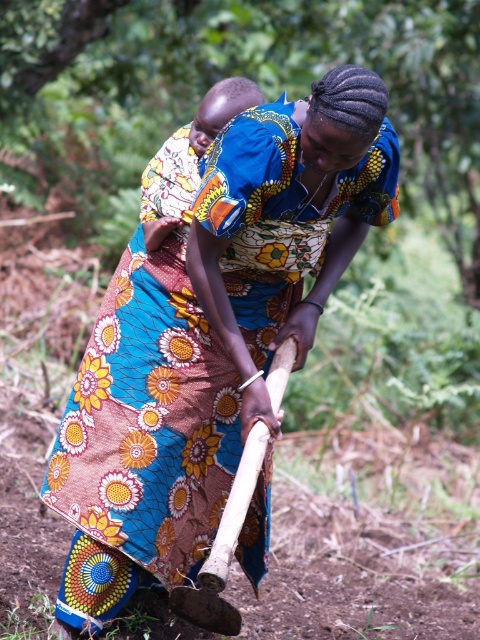
You are a farmer who needs to choose between the wooden hoe at center and the wooden shovel at center to dig a hole for planting seeds. Based on their sizes, which tool would be more suitable for digging?

The wooden shovel at center is more suitable for digging because the wooden hoe at center is much taller, making it less ideal for digging tasks which require a shorter tool.

You are a farmer who needs to choose a tool to dig a hole for planting a large tree. You see the wooden hoe at center and the wooden shovel at center. Which tool is more suitable for digging a deep hole?

The wooden shovel at center is more suitable for digging a deep hole because it is smaller and designed for precise digging, unlike the wooden hoe at center which is bigger and better for tilling soil.